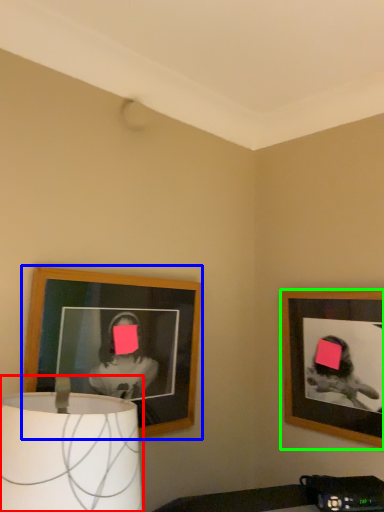
Question: Which object is the closest to the lamp (highlighted by a red box)? Choose among these: picture frame (highlighted by a blue box) or picture frame (highlighted by a green box).

Choices:
 (A) picture frame
 (B) picture frame

Answer: (A)